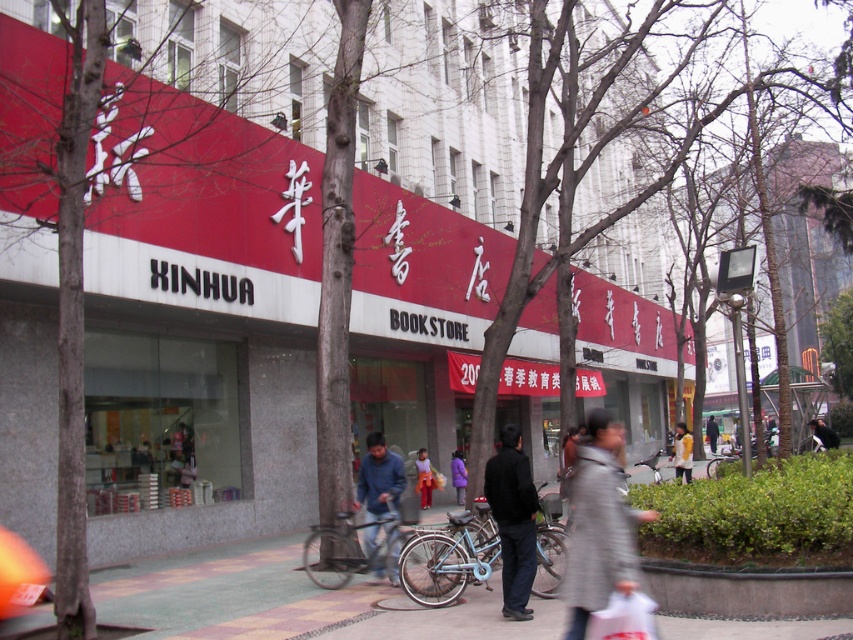
You are a photographer standing in front of the Xinhua Bookstore. You notice a person wearing blue denim jeans at center and a denim jacket at center. From your perspective, which clothing item is positioned to the left?

The blue denim jeans at center is to the left of the denim jacket at center.

You are standing on the sidewalk in front of the Xinhua Bookstore. You see the matte red bookstore at center and the blue denim jeans at center. Which object is positioned to the right from your perspective?

The matte red bookstore at center is positioned to the right of the blue denim jeans at center from your perspective.

In the scene shown: You are a customer looking to pick up a jacket from the store. You see a light gray jacket at center and a denim jacket at center. Which jacket is closer to you?

The light gray jacket at center is positioned under the denim jacket at center, which means the denim jacket at center is closer to you.